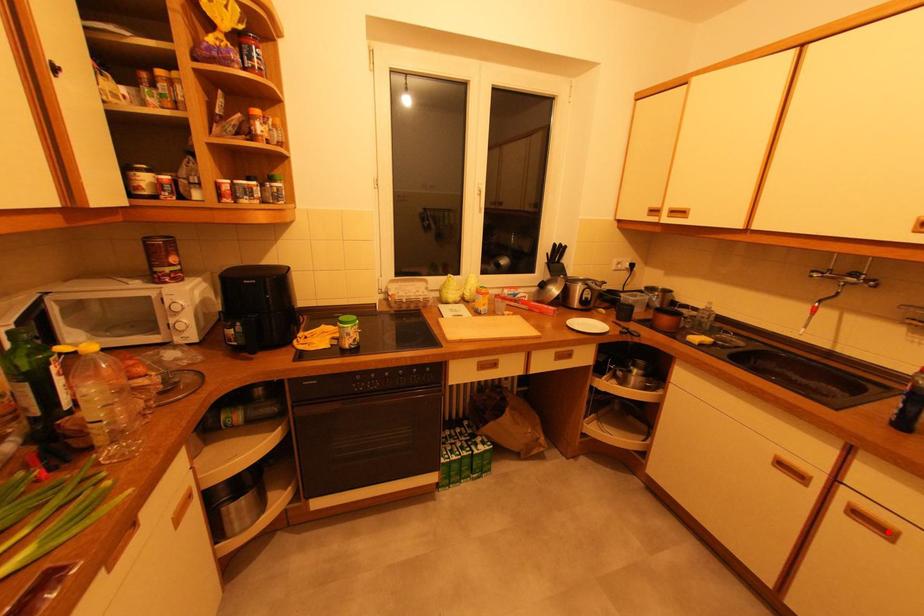
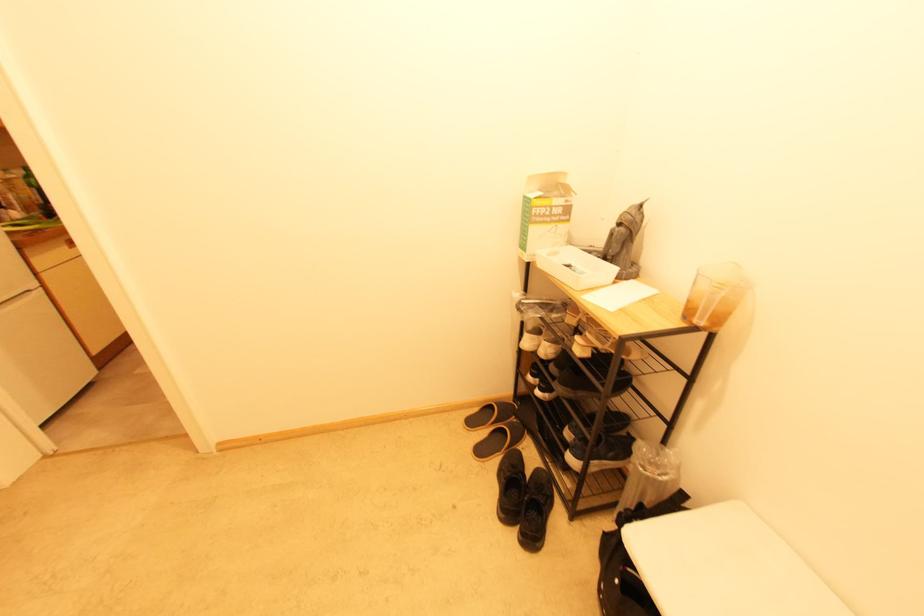
Question: I am providing you with two images of the same scene from different viewpoints. A red point is marked on the first image. At the location where the point appears in image 1, is it still visible in image 2?

Choices:
 (A) Yes
 (B) No

Answer: (B)